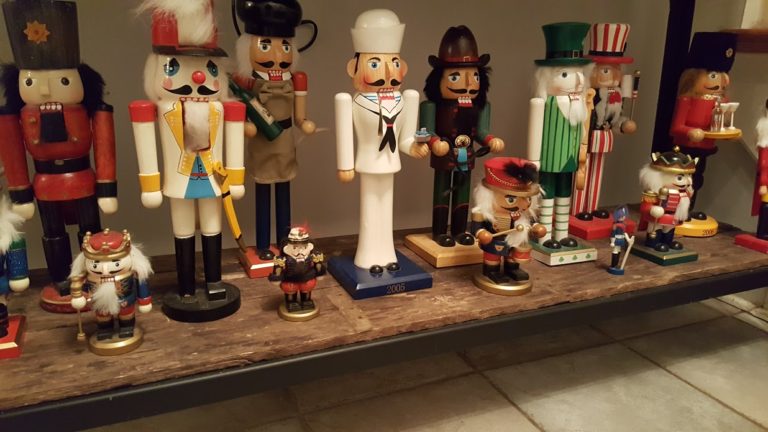
I want to click on edge of the table, so click(432, 343).